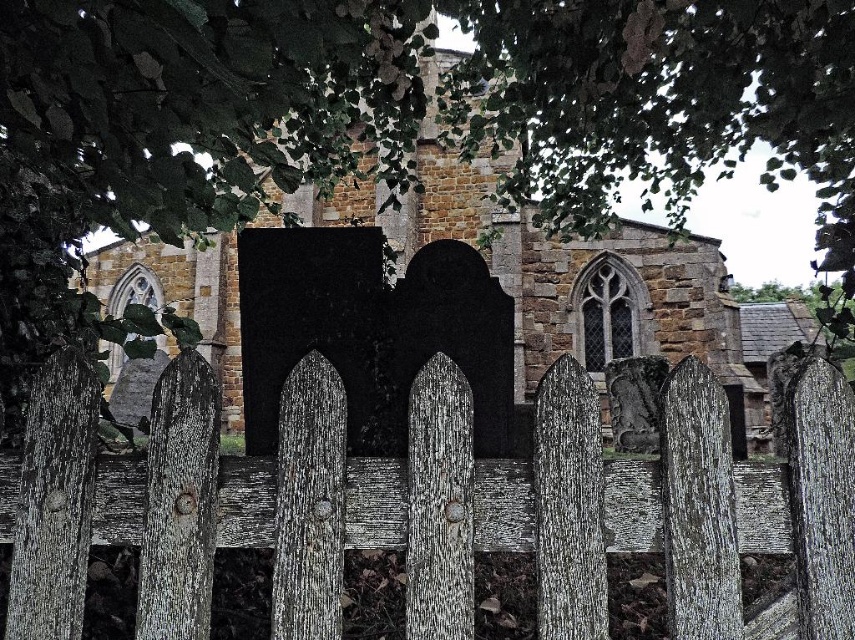
You are standing in front of the weathered wood fence at center and the stone church at center. Which object is positioned to the left?

The stone church at center is positioned to the left of the weathered wood fence at center.

You are standing in a park and see the weathered wood fence at center and the stone church at center. Which object is closer to you?

The weathered wood fence at center is closer to you because it is in front of the stone church at center.